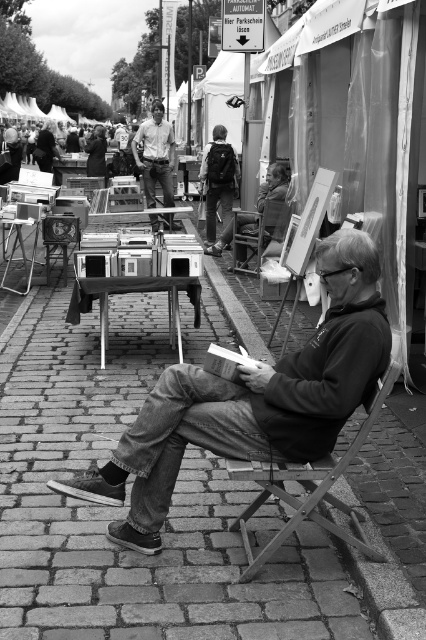
Where is the matte khaki pants at center located in the image?

The matte khaki pants at center is located at point (155, 156) in the image.